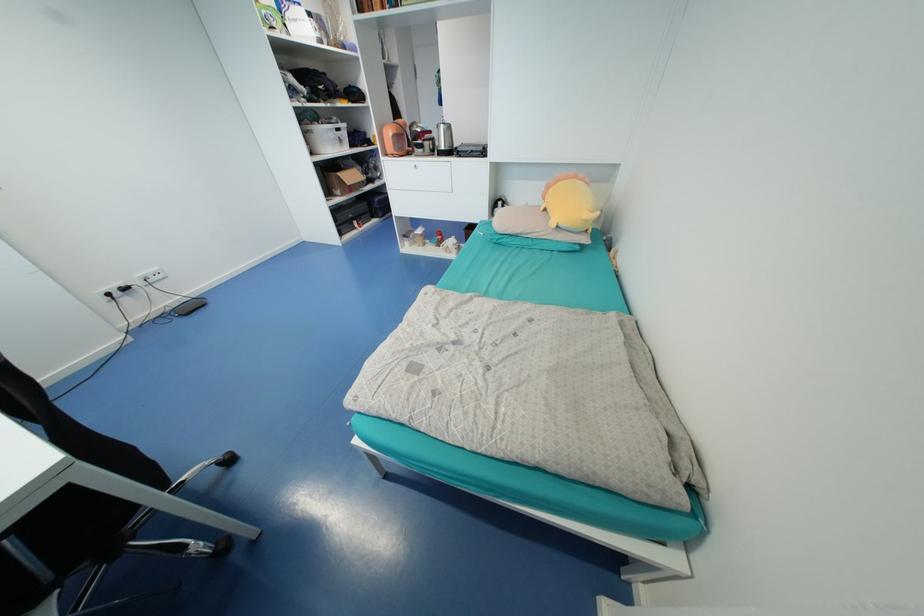
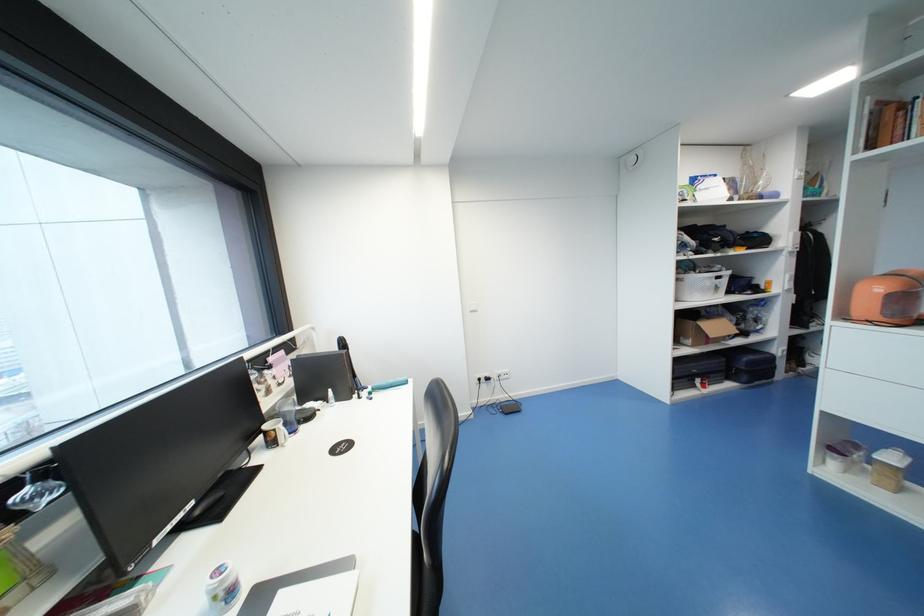
The point at (341, 190) is marked in the first image. Where is the corresponding point in the second image?

(690, 339)